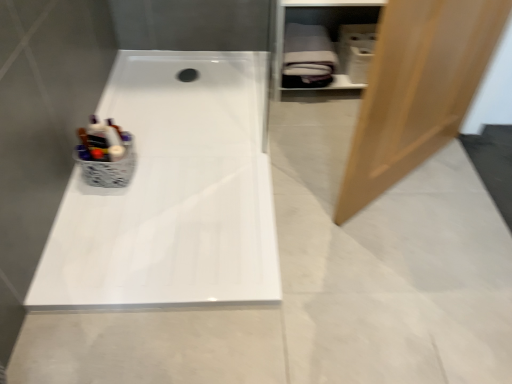
Question: Considering the relative positions of white glossy bathtub at center and white matte shelf at upper right in the image provided, is white glossy bathtub at center behind white matte shelf at upper right?

Choices:
 (A) no
 (B) yes

Answer: (A)

Question: Is white matte shelf at upper right at the back of white glossy bathtub at center?

Choices:
 (A) yes
 (B) no

Answer: (B)

Question: Considering the relative sizes of white glossy bathtub at center and white matte shelf at upper right in the image provided, is white glossy bathtub at center wider than white matte shelf at upper right?

Choices:
 (A) yes
 (B) no

Answer: (A)

Question: From a real-world perspective, is white glossy bathtub at center located higher than white matte shelf at upper right?

Choices:
 (A) yes
 (B) no

Answer: (B)

Question: Does white glossy bathtub at center have a larger size compared to white matte shelf at upper right?

Choices:
 (A) yes
 (B) no

Answer: (B)

Question: Is white glossy bathtub at center outside white matte shelf at upper right?

Choices:
 (A) no
 (B) yes

Answer: (B)

Question: Is white matte shelf at upper right wider than light brown wood door at right?

Choices:
 (A) yes
 (B) no

Answer: (A)

Question: From the image's perspective, is white matte shelf at upper right over light brown wood door at right?

Choices:
 (A) yes
 (B) no

Answer: (A)

Question: From a real-world perspective, is white matte shelf at upper right on top of light brown wood door at right?

Choices:
 (A) yes
 (B) no

Answer: (B)

Question: Can you confirm if white matte shelf at upper right is positioned to the right of light brown wood door at right?

Choices:
 (A) yes
 (B) no

Answer: (B)

Question: Can you confirm if white matte shelf at upper right is thinner than light brown wood door at right?

Choices:
 (A) yes
 (B) no

Answer: (B)

Question: Considering the relative positions of white matte shelf at upper right and light brown wood door at right in the image provided, is white matte shelf at upper right to the left of light brown wood door at right from the viewer's perspective?

Choices:
 (A) yes
 (B) no

Answer: (A)

Question: Could you tell me if white glossy bathtub at center is facing light brown wood door at right?

Choices:
 (A) no
 (B) yes

Answer: (A)